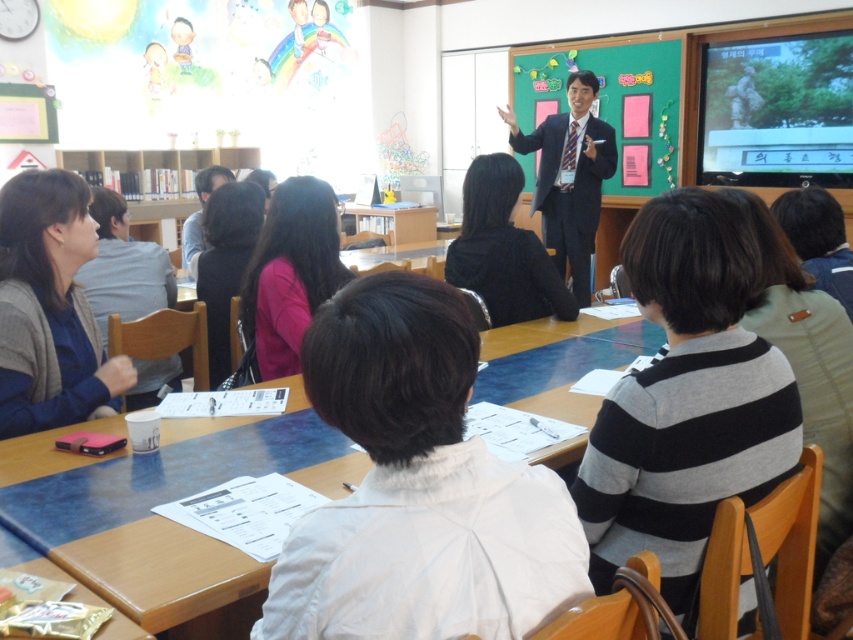
Question: Is the position of matte black sweater at left less distant than that of black suit at center?

Choices:
 (A) yes
 (B) no

Answer: (A)

Question: Based on their relative distances, which object is nearer to the green matte chalkboard at center?

Choices:
 (A) black suit at center
 (B) blue glossy table at center
 (C) pink matte shirt at center

Answer: (A)

Question: Which object appears farthest from the camera in this image?

Choices:
 (A) blue glossy table at center
 (B) matte black sweater at left

Answer: (B)

Question: Is green matte chalkboard at center above pink matte shirt at center?

Choices:
 (A) no
 (B) yes

Answer: (B)

Question: Where is striped sweater at center located in relation to pink matte shirt at center in the image?

Choices:
 (A) left
 (B) right

Answer: (B)

Question: Among these objects, which one is farthest from the camera?

Choices:
 (A) striped sweater at center
 (B) black suit at center

Answer: (B)